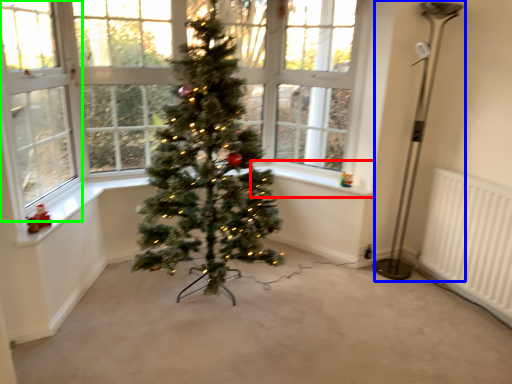
Question: Which object is the farthest from window sill (highlighted by a red box)? Choose among these: lamp (highlighted by a blue box) or window screen (highlighted by a green box).

Choices:
 (A) lamp
 (B) window screen

Answer: (B)